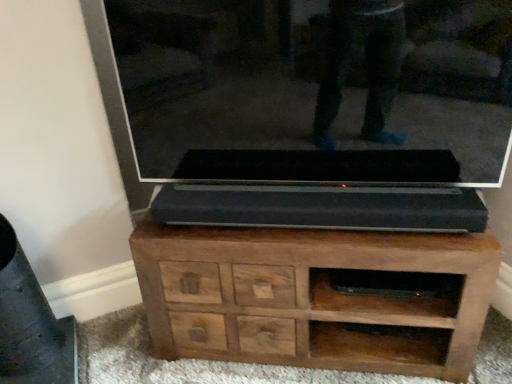
This screenshot has height=384, width=512. What do you see at coordinates (313, 298) in the screenshot? I see `brown wood chest of drawers at center` at bounding box center [313, 298].

This screenshot has height=384, width=512. Find the location of `brown wood chest of drawers at center`. brown wood chest of drawers at center is located at coordinates (313, 298).

Measure the distance between point (318, 297) and camera.

Point (318, 297) is 4.33 feet away from camera.

What is the approximate width of transparent glass tv at center?

transparent glass tv at center is 6.72 inches wide.

In order to click on transparent glass tv at center in this screenshot , I will do `click(309, 89)`.

This screenshot has width=512, height=384. Describe the element at coordinates (309, 89) in the screenshot. I see `transparent glass tv at center` at that location.

At what (x,y) coordinates should I click in order to perform the action: click on brown wood chest of drawers at center. Please return your answer as a coordinate pair (x, y). The image size is (512, 384). Looking at the image, I should click on coord(313,298).

In the image, is brown wood chest of drawers at center on the left side or the right side of transparent glass tv at center?

Clearly, brown wood chest of drawers at center is on the right of transparent glass tv at center in the image.

Which object is further away from the camera, brown wood chest of drawers at center or transparent glass tv at center?

brown wood chest of drawers at center is further away from the camera.

Which is less distant, (453, 307) or (422, 25)?

The point (422, 25) is closer.

From the image's perspective, would you say brown wood chest of drawers at center is positioned over transparent glass tv at center?

Actually, brown wood chest of drawers at center appears below transparent glass tv at center in the image.

From a real-world perspective, between brown wood chest of drawers at center and transparent glass tv at center, who is vertically higher?

From a 3D spatial view, transparent glass tv at center is above.

Considering the sizes of brown wood chest of drawers at center and transparent glass tv at center in the image, is brown wood chest of drawers at center wider or thinner than transparent glass tv at center?

Clearly, brown wood chest of drawers at center has more width compared to transparent glass tv at center.

Between brown wood chest of drawers at center and transparent glass tv at center, which one has less height?

With less height is brown wood chest of drawers at center.

Considering the relative sizes of brown wood chest of drawers at center and transparent glass tv at center in the image provided, is brown wood chest of drawers at center bigger than transparent glass tv at center?

Yes.

Is brown wood chest of drawers at center completely or partially outside of transparent glass tv at center?

brown wood chest of drawers at center lies outside transparent glass tv at center's area.

Is brown wood chest of drawers at center not close to transparent glass tv at center?

brown wood chest of drawers at center is near transparent glass tv at center, not far away.

Is brown wood chest of drawers at center looking in the opposite direction of transparent glass tv at center?

No, transparent glass tv at center is not at the back of brown wood chest of drawers at center.

Find the location of a particular element. Image resolution: width=512 pixels, height=384 pixels. glass door that is on the left side of brown wood chest of drawers at center is located at coordinates pos(309,89).

Considering the relative positions of transparent glass tv at center and brown wood chest of drawers at center in the image provided, is transparent glass tv at center to the left of brown wood chest of drawers at center from the viewer's perspective?

→ Yes, transparent glass tv at center is to the left of brown wood chest of drawers at center.

Is transparent glass tv at center in front of or behind brown wood chest of drawers at center in the image?

transparent glass tv at center is in front of brown wood chest of drawers at center.

Does point (176, 27) come closer to viewer compared to point (214, 287)?

Yes, it is in front of point (214, 287).

From the image's perspective, is transparent glass tv at center positioned above or below brown wood chest of drawers at center?

transparent glass tv at center is above brown wood chest of drawers at center.

Based on the photo, from a real-world perspective, is transparent glass tv at center beneath brown wood chest of drawers at center?

No, from a real-world perspective, transparent glass tv at center is not under brown wood chest of drawers at center.

Is transparent glass tv at center wider than brown wood chest of drawers at center?

In fact, transparent glass tv at center might be narrower than brown wood chest of drawers at center.

Between transparent glass tv at center and brown wood chest of drawers at center, which one has less height?

brown wood chest of drawers at center.

Based on the photo, between transparent glass tv at center and brown wood chest of drawers at center, which one has larger size?

brown wood chest of drawers at center is bigger.

Consider the image. Is transparent glass tv at center positioned beyond the bounds of brown wood chest of drawers at center?

transparent glass tv at center is positioned outside brown wood chest of drawers at center.

Is transparent glass tv at center beside brown wood chest of drawers at center?

transparent glass tv at center and brown wood chest of drawers at center are not in contact.

Does transparent glass tv at center turn towards brown wood chest of drawers at center?

No, transparent glass tv at center does not turn towards brown wood chest of drawers at center.

What's the angular difference between transparent glass tv at center and brown wood chest of drawers at center's facing directions?

They differ by 0.000995 degrees in their facing directions.

Measure the distance between transparent glass tv at center and brown wood chest of drawers at center.

transparent glass tv at center is 15.34 inches from brown wood chest of drawers at center.

Find the location of a particular element. the chest of drawers located underneath the transparent glass tv at center (from a real-world perspective) is located at coordinates (313, 298).

This screenshot has height=384, width=512. I want to click on glass door above the brown wood chest of drawers at center (from a real-world perspective), so click(309, 89).

The height and width of the screenshot is (384, 512). I want to click on glass door above the brown wood chest of drawers at center (from the image's perspective), so click(309, 89).